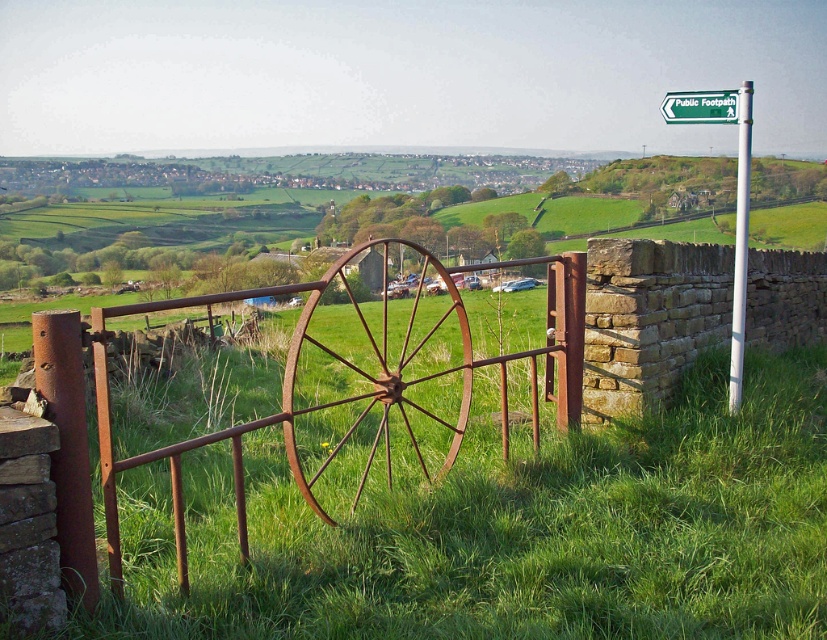
Question: Is green plastic signpost at upper right wider than green plastic sign at upper right?

Choices:
 (A) no
 (B) yes

Answer: (B)

Question: Is rusty metal gate at center above green plastic signpost at upper right?

Choices:
 (A) no
 (B) yes

Answer: (A)

Question: Estimate the real-world distances between objects in this image. Which object is farther from the green plastic sign at upper right?

Choices:
 (A) rusty metal wagon wheel at center
 (B) green plastic signpost at upper right

Answer: (B)

Question: Can you confirm if rusty metal gate at center is positioned to the left of white metallic pole at upper right?

Choices:
 (A) no
 (B) yes

Answer: (B)

Question: Among these objects, which one is farthest from the camera?

Choices:
 (A) green plastic sign at upper right
 (B) green plastic signpost at upper right
 (C) rusty metal wagon wheel at center
 (D) white metallic pole at upper right

Answer: (D)

Question: Which of the following is the farthest from the observer?

Choices:
 (A) green plastic signpost at upper right
 (B) white metallic pole at upper right
 (C) rusty metal gate at center
 (D) rusty metal wagon wheel at center

Answer: (B)